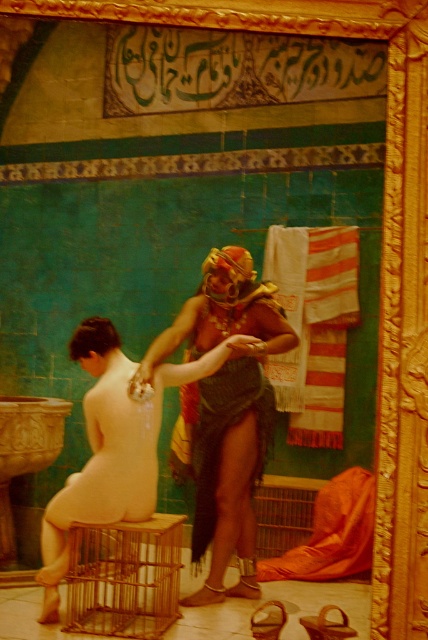
Who is positioned more to the left, matte brown skin at center or gold wire cage at lower left?

matte brown skin at center

Is point (133, 467) positioned in front of point (178, 572)?

That is False.

Does point (109, 515) come behind point (171, 564)?

Yes, point (109, 515) is farther from viewer.

The width and height of the screenshot is (428, 640). I want to click on matte brown skin at center, so click(x=112, y=445).

How much distance is there between gold wire cage at lower left and dark green textured cloth at center?

gold wire cage at lower left and dark green textured cloth at center are 10.15 inches apart.

What do you see at coordinates (124, 577) in the screenshot? This screenshot has width=428, height=640. I see `gold wire cage at lower left` at bounding box center [124, 577].

This screenshot has width=428, height=640. I want to click on gold wire cage at lower left, so click(x=124, y=577).

Looking at this image, which is more to the right, matte brown skin at center or dark green textured cloth at center?

Positioned to the right is dark green textured cloth at center.

Can you confirm if matte brown skin at center is taller than dark green textured cloth at center?

Yes, matte brown skin at center is taller than dark green textured cloth at center.

Does point (109, 324) lie behind point (213, 486)?

Yes, point (109, 324) is behind point (213, 486).

I want to click on matte brown skin at center, so click(112, 445).